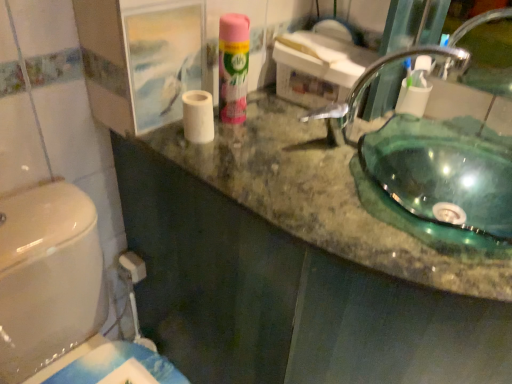
You are a GUI agent. You are given a task and a screenshot of the screen. Output one action in this format:
    pyautogui.click(x=<x>, y=<y>)
    Task: Click on the vacant space situated on the left part of white matte toilet paper at upper right, the first toilet paper when ordered from back to front
    The height and width of the screenshot is (384, 512).
    Given the screenshot: What is the action you would take?
    pyautogui.click(x=346, y=132)